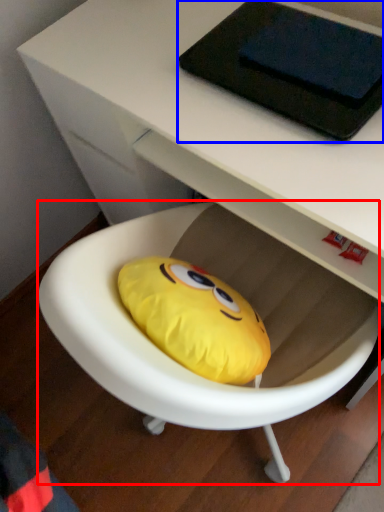
Question: Which object is further to the camera taking this photo, bean bag chair (highlighted by a red box) or tablet computer (highlighted by a blue box)?

Choices:
 (A) bean bag chair
 (B) tablet computer

Answer: (B)